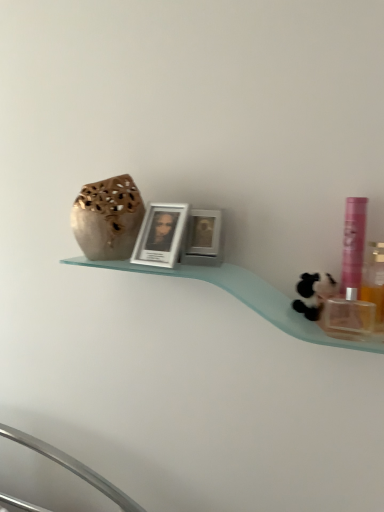
In the scene shown: Measure the distance between point [354,217] and camera.

38.43 inches.

What do you see at coordinates (203, 238) in the screenshot?
I see `metallic silver picture frame at center, arranged as the first picture frame when viewed from the right` at bounding box center [203, 238].

This screenshot has width=384, height=512. I want to click on black plush toy at right, so click(x=313, y=294).

Describe the element at coordinates (107, 218) in the screenshot. I see `matte beige vase at upper left` at that location.

The width and height of the screenshot is (384, 512). What are the coordinates of `matte beige vase at upper left` in the screenshot? It's located at (107, 218).

Measure the distance between point [380,261] and camera.

Point [380,261] is 1.11 meters away from camera.

Identify the location of white glossy picture frame at center, which is the 2th picture frame from right to left. This screenshot has height=512, width=384. (161, 234).

I want to click on pink plastic mouthwash at right, arranged as the first mouthwash when viewed from the left, so click(x=353, y=242).

Between pink plastic mouthwash at right, arranged as the first mouthwash when viewed from the left, and black plush toy at right, which one has larger width?

black plush toy at right is wider.

Is black plush toy at right at the back of pink plastic mouthwash at right, which is counted as the second mouthwash, starting from the right?

No, pink plastic mouthwash at right, which is counted as the second mouthwash, starting from the right, is not facing the opposite direction of black plush toy at right.

From the black plush toy at right, count 1st mouthwash to the right and point to it. Please provide its 2D coordinates.

[(353, 242)]

Which object is closer to the camera, pink plastic mouthwash at right, arranged as the first mouthwash when viewed from the left, or black plush toy at right?

pink plastic mouthwash at right, arranged as the first mouthwash when viewed from the left, is in front.

Looking at this image, is pink plastic mouthwash at right, which is counted as the second mouthwash, starting from the right, completely or partially outside of matte beige vase at upper left?

pink plastic mouthwash at right, which is counted as the second mouthwash, starting from the right, is positioned outside matte beige vase at upper left.

From the image's perspective, is pink plastic mouthwash at right, which is counted as the second mouthwash, starting from the right, on matte beige vase at upper left?

No, from the image's perspective, pink plastic mouthwash at right, which is counted as the second mouthwash, starting from the right, is not over matte beige vase at upper left.

Does pink plastic mouthwash at right, which is counted as the second mouthwash, starting from the right, have a greater height compared to matte beige vase at upper left?

Correct, pink plastic mouthwash at right, which is counted as the second mouthwash, starting from the right, is much taller as matte beige vase at upper left.

Which of these two, pink plastic mouthwash at right, which is counted as the second mouthwash, starting from the right, or matte beige vase at upper left, is smaller?

Smaller between the two is pink plastic mouthwash at right, which is counted as the second mouthwash, starting from the right.

Considering the relative sizes of metallic silver picture frame at center, the 2th picture frame when ordered from left to right, and black plush toy at right in the image provided, is metallic silver picture frame at center, the 2th picture frame when ordered from left to right, wider than black plush toy at right?

No, metallic silver picture frame at center, the 2th picture frame when ordered from left to right, is not wider than black plush toy at right.

Is metallic silver picture frame at center, the 2th picture frame when ordered from left to right, not inside black plush toy at right?

Yes, metallic silver picture frame at center, the 2th picture frame when ordered from left to right, is not within black plush toy at right.

Based on the photo, from a real-world perspective, is metallic silver picture frame at center, arranged as the first picture frame when viewed from the right, physically above black plush toy at right?

Yes, from a real-world perspective, metallic silver picture frame at center, arranged as the first picture frame when viewed from the right, is above black plush toy at right.

Between metallic silver picture frame at center, the 2th picture frame when ordered from left to right, and black plush toy at right, which one has more height?

metallic silver picture frame at center, the 2th picture frame when ordered from left to right, is taller.

Which is behind, translucent plastic bottle at right, which appears as the second mouthwash when viewed from the left, or pink plastic mouthwash at right, which is counted as the second mouthwash, starting from the right?

pink plastic mouthwash at right, which is counted as the second mouthwash, starting from the right, is behind.

Is translucent plastic bottle at right, which appears as the second mouthwash when viewed from the left, positioned beyond the bounds of pink plastic mouthwash at right, arranged as the first mouthwash when viewed from the left?

Yes, translucent plastic bottle at right, which appears as the second mouthwash when viewed from the left, is outside of pink plastic mouthwash at right, arranged as the first mouthwash when viewed from the left.

From a real-world perspective, which is physically below, translucent plastic bottle at right, marked as the first mouthwash in a right-to-left arrangement, or pink plastic mouthwash at right, which is counted as the second mouthwash, starting from the right?

From a 3D spatial view, translucent plastic bottle at right, marked as the first mouthwash in a right-to-left arrangement, is below.

Can you confirm if translucent plastic bottle at right, marked as the first mouthwash in a right-to-left arrangement, is positioned to the right of pink plastic mouthwash at right, arranged as the first mouthwash when viewed from the left?

Indeed, translucent plastic bottle at right, marked as the first mouthwash in a right-to-left arrangement, is positioned on the right side of pink plastic mouthwash at right, arranged as the first mouthwash when viewed from the left.

Between point (377, 254) and point (166, 255), which one is positioned behind?

Point (377, 254)

Which of these two, translucent plastic bottle at right, marked as the first mouthwash in a right-to-left arrangement, or white glossy picture frame at center, which is the 2th picture frame from right to left, stands taller?

translucent plastic bottle at right, marked as the first mouthwash in a right-to-left arrangement, is taller.

Looking at their sizes, would you say translucent plastic bottle at right, marked as the first mouthwash in a right-to-left arrangement, is wider or thinner than white glossy picture frame at center, which is the 2th picture frame from right to left?

In the image, translucent plastic bottle at right, marked as the first mouthwash in a right-to-left arrangement, appears to be more narrow than white glossy picture frame at center, which is the 2th picture frame from right to left.

Is translucent plastic bottle at right, marked as the first mouthwash in a right-to-left arrangement, at the right side of white glossy picture frame at center, acting as the first picture frame starting from the left?

Indeed, translucent plastic bottle at right, marked as the first mouthwash in a right-to-left arrangement, is positioned on the right side of white glossy picture frame at center, acting as the first picture frame starting from the left.

Could you tell me if matte beige vase at upper left is turned towards pink plastic mouthwash at right, which is counted as the second mouthwash, starting from the right?

No, matte beige vase at upper left is not turned towards pink plastic mouthwash at right, which is counted as the second mouthwash, starting from the right.

From the image's perspective, does matte beige vase at upper left appear higher than pink plastic mouthwash at right, which is counted as the second mouthwash, starting from the right?

Yes, from the image's perspective, matte beige vase at upper left is over pink plastic mouthwash at right, which is counted as the second mouthwash, starting from the right.

Can you tell me how much matte beige vase at upper left and pink plastic mouthwash at right, which is counted as the second mouthwash, starting from the right, differ in facing direction?

The facing directions of matte beige vase at upper left and pink plastic mouthwash at right, which is counted as the second mouthwash, starting from the right, are 11.1 degrees apart.

Is point (124, 203) in front of point (354, 280)?

That is False.

From the image's perspective, would you say metallic silver picture frame at center, arranged as the first picture frame when viewed from the right, is positioned over white glossy picture frame at center, which is the 2th picture frame from right to left?

No, from the image's perspective, metallic silver picture frame at center, arranged as the first picture frame when viewed from the right, is not above white glossy picture frame at center, which is the 2th picture frame from right to left.

Is point (210, 264) in front of point (163, 266)?

No, it is not.

What's the angular difference between metallic silver picture frame at center, arranged as the first picture frame when viewed from the right, and white glossy picture frame at center, which is the 2th picture frame from right to left,'s facing directions?

The angle between the facing direction of metallic silver picture frame at center, arranged as the first picture frame when viewed from the right, and the facing direction of white glossy picture frame at center, which is the 2th picture frame from right to left, is 2.02 degrees.

At what (x,y) coordinates should I click in order to perform the action: click on animal that appears on the left of pink plastic mouthwash at right, which is counted as the second mouthwash, starting from the right. Please return your answer as a coordinate pair (x, y). Looking at the image, I should click on coord(313,294).

This screenshot has height=512, width=384. What are the coordinates of `vase behind the pink plastic mouthwash at right, arranged as the first mouthwash when viewed from the left` in the screenshot? It's located at (107, 218).

Considering their positions, is translucent plastic bottle at right, which appears as the second mouthwash when viewed from the left, positioned closer to pink plastic mouthwash at right, which is counted as the second mouthwash, starting from the right, than white glossy picture frame at center, which is the 2th picture frame from right to left?

translucent plastic bottle at right, which appears as the second mouthwash when viewed from the left, lies closer to pink plastic mouthwash at right, which is counted as the second mouthwash, starting from the right, than the other object.

From the image, which object appears to be farther from translucent plastic bottle at right, which appears as the second mouthwash when viewed from the left, black plush toy at right or pink plastic mouthwash at right, which is counted as the second mouthwash, starting from the right?

black plush toy at right.

Based on their spatial positions, is metallic silver picture frame at center, arranged as the first picture frame when viewed from the right, or translucent plastic bottle at right, marked as the first mouthwash in a right-to-left arrangement, closer to pink plastic mouthwash at right, which is counted as the second mouthwash, starting from the right?

translucent plastic bottle at right, marked as the first mouthwash in a right-to-left arrangement, is closer to pink plastic mouthwash at right, which is counted as the second mouthwash, starting from the right.

Which object lies nearer to the anchor point pink plastic mouthwash at right, arranged as the first mouthwash when viewed from the left, black plush toy at right or translucent plastic bottle at right, which appears as the second mouthwash when viewed from the left?

Among the two, black plush toy at right is located nearer to pink plastic mouthwash at right, arranged as the first mouthwash when viewed from the left.

Which object lies further to the anchor point black plush toy at right, metallic silver picture frame at center, the 2th picture frame when ordered from left to right, or pink plastic mouthwash at right, arranged as the first mouthwash when viewed from the left?

The object further to black plush toy at right is metallic silver picture frame at center, the 2th picture frame when ordered from left to right.

Based on their spatial positions, is translucent plastic bottle at right, marked as the first mouthwash in a right-to-left arrangement, or white glossy picture frame at center, acting as the first picture frame starting from the left, further from metallic silver picture frame at center, the 2th picture frame when ordered from left to right?

translucent plastic bottle at right, marked as the first mouthwash in a right-to-left arrangement.

Considering their positions, is matte beige vase at upper left positioned further to translucent plastic bottle at right, marked as the first mouthwash in a right-to-left arrangement, than white glossy picture frame at center, acting as the first picture frame starting from the left?

Based on the image, matte beige vase at upper left appears to be further to translucent plastic bottle at right, marked as the first mouthwash in a right-to-left arrangement.

From the image, which object appears to be nearer to black plush toy at right, metallic silver picture frame at center, arranged as the first picture frame when viewed from the right, or white glossy picture frame at center, acting as the first picture frame starting from the left?

metallic silver picture frame at center, arranged as the first picture frame when viewed from the right, lies closer to black plush toy at right than the other object.

Locate an element on the screen. animal between white glossy picture frame at center, which is the 2th picture frame from right to left, and pink plastic mouthwash at right, which is counted as the second mouthwash, starting from the right, in the horizontal direction is located at coordinates (313, 294).

Find the location of a particular element. This screenshot has width=384, height=512. animal between matte beige vase at upper left and pink plastic mouthwash at right, which is counted as the second mouthwash, starting from the right is located at coordinates (313, 294).

At what (x,y) coordinates should I click in order to perform the action: click on mouthwash located between metallic silver picture frame at center, arranged as the first picture frame when viewed from the right, and translucent plastic bottle at right, which appears as the second mouthwash when viewed from the left, in the left-right direction. Please return your answer as a coordinate pair (x, y). This screenshot has height=512, width=384. Looking at the image, I should click on (353, 242).

Find the location of a particular element. picture frame between white glossy picture frame at center, which is the 2th picture frame from right to left, and translucent plastic bottle at right, marked as the first mouthwash in a right-to-left arrangement, in the horizontal direction is located at coordinates (203, 238).